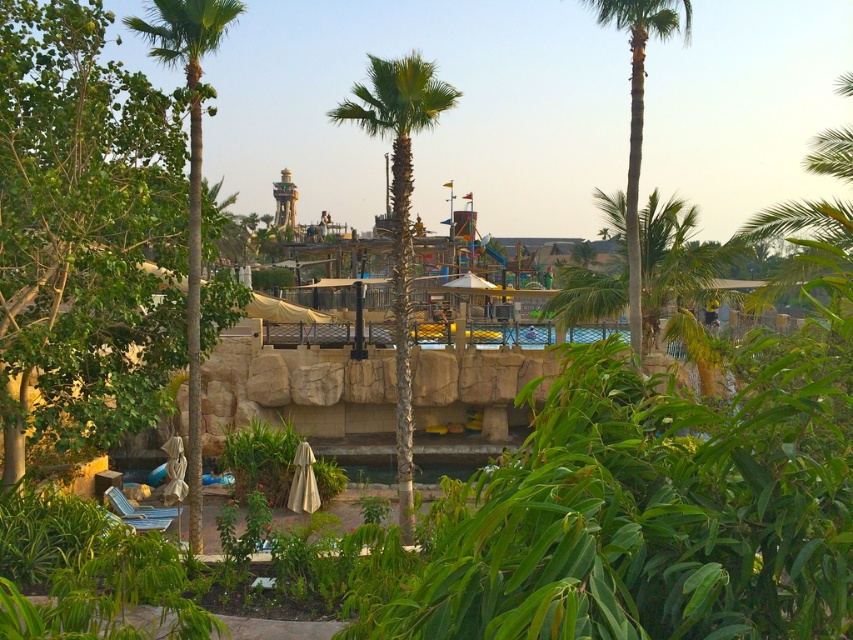
You are standing in the recreational area and want to take a photo of both the green textured palm tree at center and the green leafy palm tree at left. Which palm tree should you position yourself to the right of to capture both in the frame?

You should position yourself to the right of the green leafy palm tree at left. Since the green textured palm tree at center is positioned on the right side of the green leafy palm tree at left, standing to the right of the latter will allow you to include both trees in your photo.

You are standing in the recreational area and want to take a photo of both the green leafy palm tree at left and the green leafy palm tree at right. Which palm tree should you position yourself closer to in order to capture both in the frame without cropping?

You should position yourself closer to the green leafy palm tree at right because it is shorter than the green leafy palm tree at left, allowing both to fit within the frame when you are nearer to the smaller one.